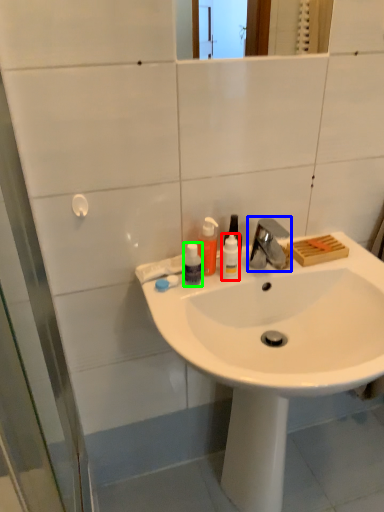
Question: Which object is the farthest from bottle (highlighted by a red box)? Choose among these: tap (highlighted by a blue box) or bottle (highlighted by a green box).

Choices:
 (A) tap
 (B) bottle

Answer: (A)